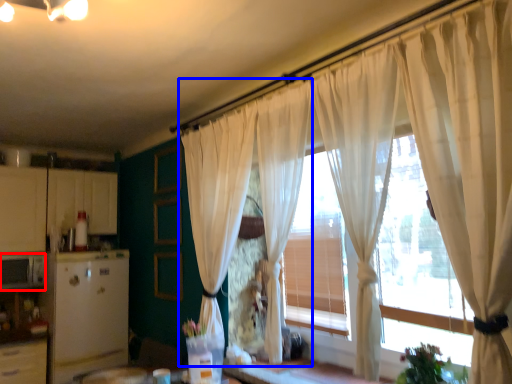
Question: Among these objects, which one is nearest to the camera, appliance (highlighted by a red box) or curtain (highlighted by a blue box)?

Choices:
 (A) appliance
 (B) curtain

Answer: (B)